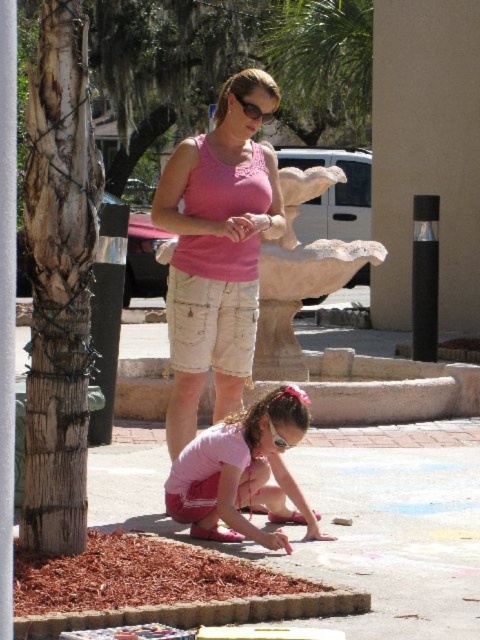
Question: Which of the following is the closest to the observer?

Choices:
 (A) pink cotton tank top at center
 (B) pink fabric shorts at lower center

Answer: (B)

Question: Can you confirm if pink cotton tank top at center is wider than green leafy palm tree at upper center?

Choices:
 (A) yes
 (B) no

Answer: (B)

Question: Which point is farther to the camera?

Choices:
 (A) pink cotton tank top at center
 (B) green leafy palm tree at upper center
 (C) pink fabric shorts at lower center

Answer: (B)

Question: Which point is closer to the camera taking this photo?

Choices:
 (A) (232, 472)
 (B) (300, 99)
 (C) (259, 176)

Answer: (A)

Question: Does pink fabric shorts at lower center have a smaller size compared to green leafy palm tree at upper center?

Choices:
 (A) no
 (B) yes

Answer: (B)

Question: Is pink cotton tank top at center smaller than pink fabric shorts at lower center?

Choices:
 (A) no
 (B) yes

Answer: (B)